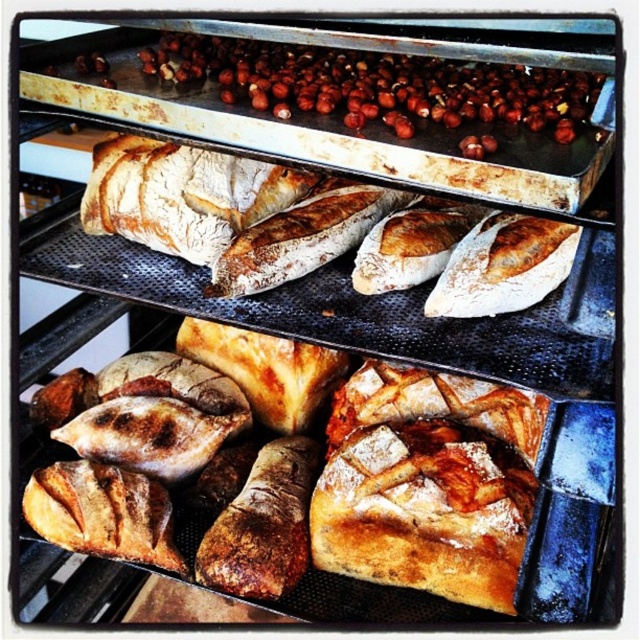
Does point (264, 177) lie in front of point (106, 45)?

Yes, it is in front of point (106, 45).

Does point (353, 218) lie behind point (182, 97)?

Yes, it is behind point (182, 97).

At what (x,y) coordinates should I click in order to perform the action: click on slightly golden crusty baguette at center. Please return your answer as a coordinate pair (x, y). This screenshot has height=640, width=640. Looking at the image, I should click on (320, 228).